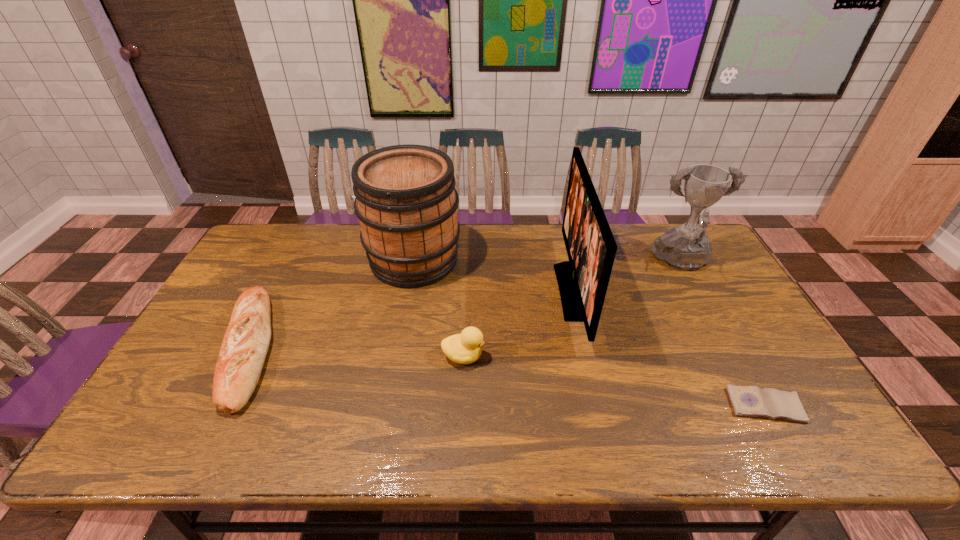
Find the location of a particular element. free region that satisfies the following two spatial constraints: 1. on the front-facing side of the duck; 2. on the back side of the diary is located at coordinates (462, 406).

Identify the location of free spot that satisfies the following two spatial constraints: 1. on the back side of the cider; 2. on the left side of the baguet. This screenshot has height=540, width=960. (294, 260).

Image resolution: width=960 pixels, height=540 pixels. Identify the location of vacant point that satisfies the following two spatial constraints: 1. on the side with emblem of the award; 2. on the front-facing side of the duck. (734, 356).